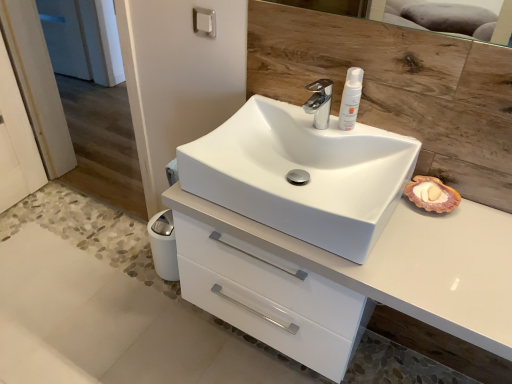
Locate an element on the screen. This screenshot has width=512, height=384. vacant space behind chrome metallic faucet at center is located at coordinates (296, 111).